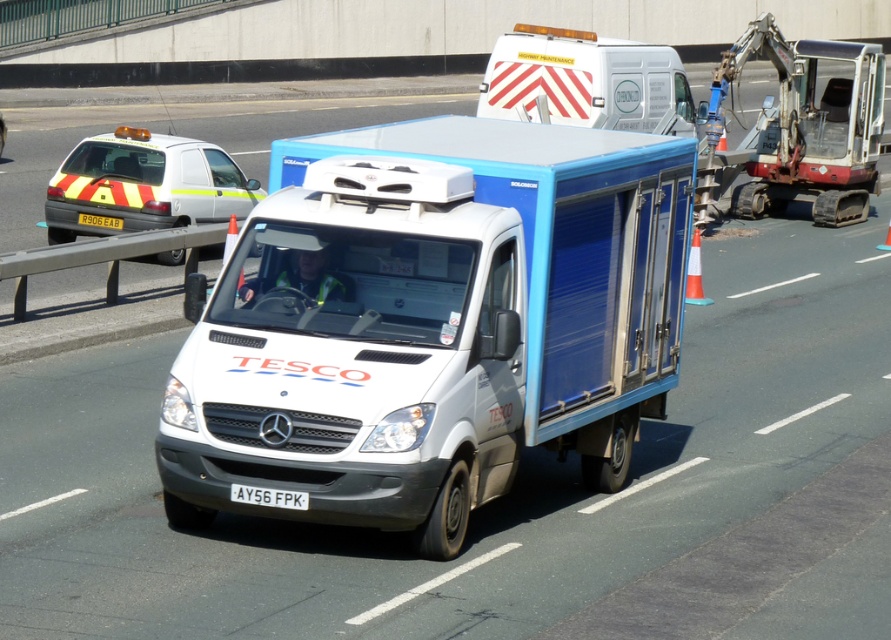
Question: Is white glossy van at center above white glossy ambulance at upper center?

Choices:
 (A) yes
 (B) no

Answer: (B)

Question: Estimate the real-world distances between objects in this image. Which object is closer to the yellow reflective plastic at center?

Choices:
 (A) white glossy van at center
 (B) white plastic excavator at upper right

Answer: (B)

Question: Which point is closer to the camera?

Choices:
 (A) (x=846, y=198)
 (B) (x=530, y=291)

Answer: (B)

Question: Is yellow and black striped taxi at left further to camera compared to yellow reflective plastic at center?

Choices:
 (A) yes
 (B) no

Answer: (B)

Question: Where is white plastic excavator at upper right located in relation to white plastic license plate at center in the image?

Choices:
 (A) below
 (B) above

Answer: (B)

Question: Which point is farther from the camera taking this photo?

Choices:
 (A) (259, 504)
 (B) (454, 477)

Answer: (B)